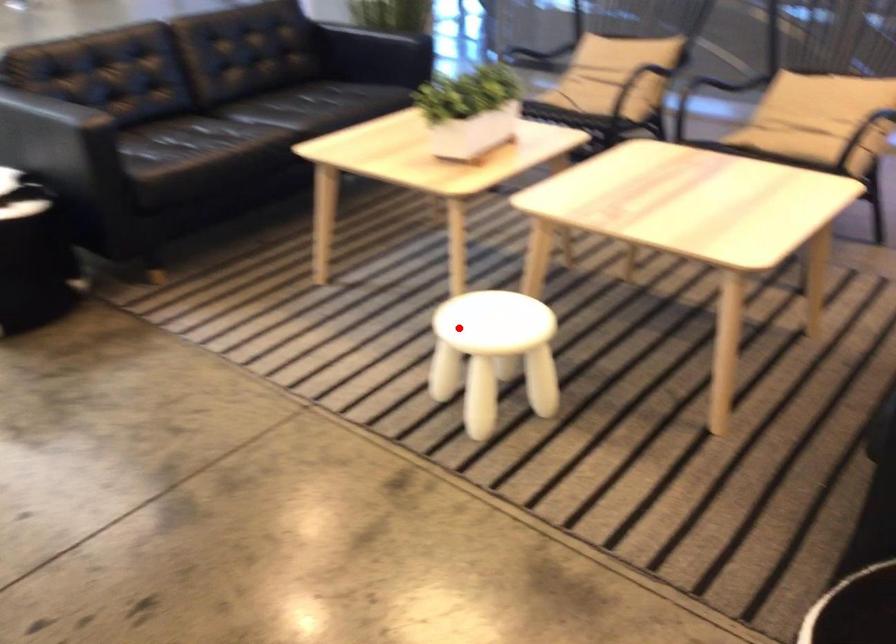
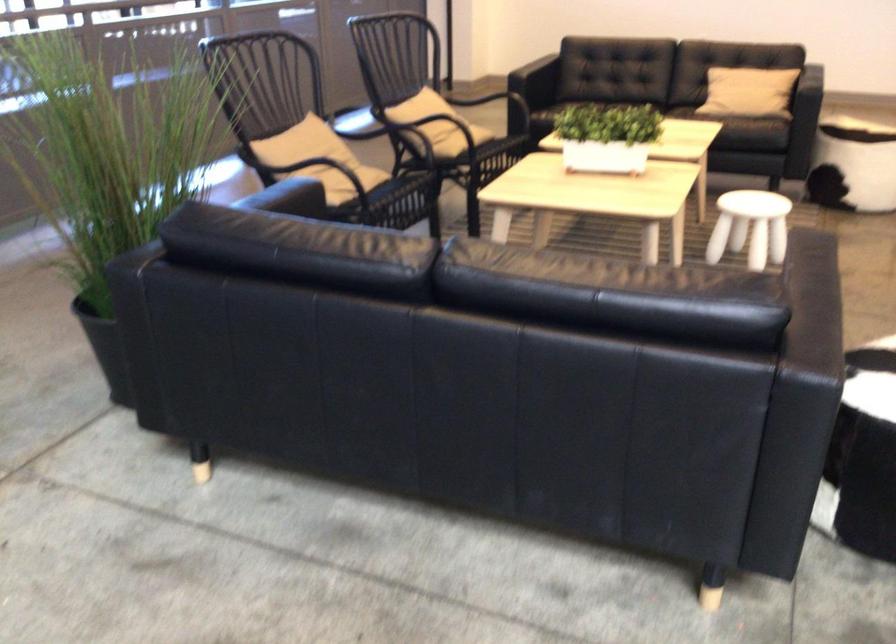
Find the pixel in the second image that matches the highlighted location in the first image.

(750, 227)